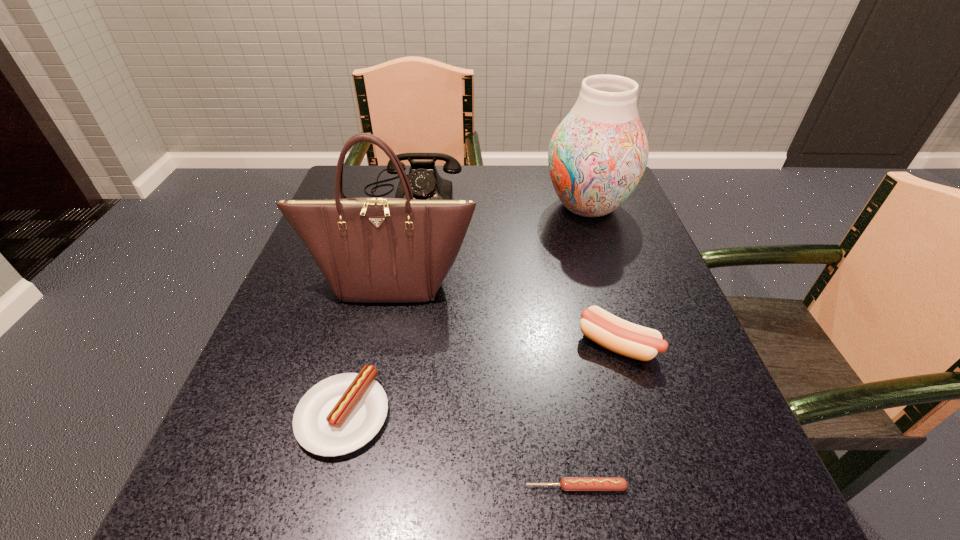
The image size is (960, 540). I want to click on blank space at the near right corner, so click(x=743, y=491).

This screenshot has width=960, height=540. I want to click on vacant space that is in between the third shortest object and the telephone, so click(x=515, y=269).

Where is `free space between the third farthest object and the fifth farthest object`? The height and width of the screenshot is (540, 960). free space between the third farthest object and the fifth farthest object is located at coordinates click(367, 349).

This screenshot has height=540, width=960. Identify the location of empty space that is in between the farthest sausage and the second nearest object. (480, 380).

The width and height of the screenshot is (960, 540). In order to click on vacant area that lies between the tallest sausage and the third farthest object in this screenshot , I will do `click(504, 314)`.

Identify the location of empty space between the vase and the shortest sausage. (582, 347).

Where is `vacant area that lies between the third farthest object and the vase`? Image resolution: width=960 pixels, height=540 pixels. vacant area that lies between the third farthest object and the vase is located at coordinates (489, 245).

Locate an element on the screen. The height and width of the screenshot is (540, 960). vacant area between the nearest object and the vase is located at coordinates (582, 347).

You are a GUI agent. You are given a task and a screenshot of the screen. Output one action in this format:
    pyautogui.click(x=<x>, y=<y>)
    Task: Click on the object that is the fifth closest to the fourth shortest object
    This screenshot has width=960, height=540.
    Given the screenshot: What is the action you would take?
    coord(567,483)

Select which object appears as the fourth closest to the handbag. Please provide its 2D coordinates. Your answer should be formatted as a tuple, i.e. [(x, y)], where the tuple contains the x and y coordinates of a point satisfying the conditions above.

[(597, 155)]